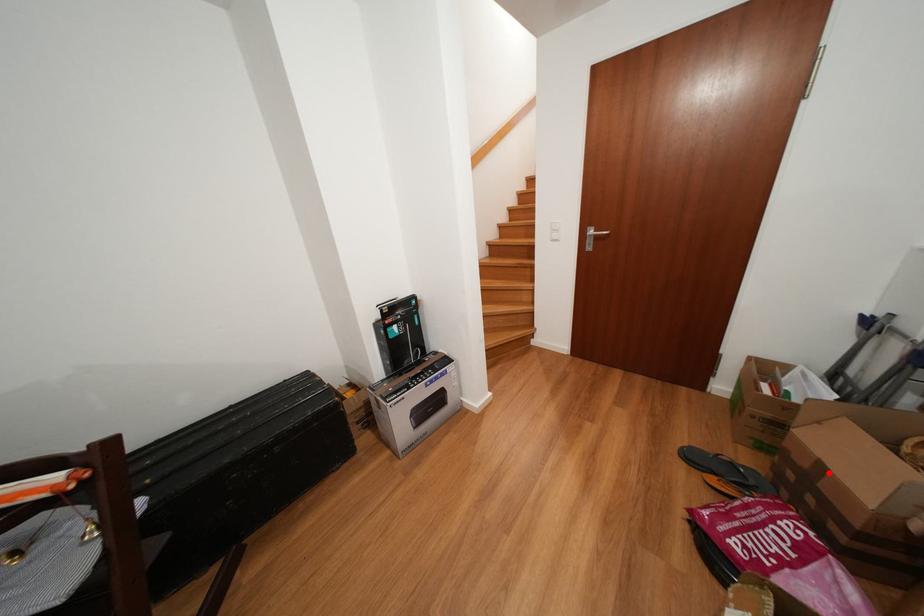
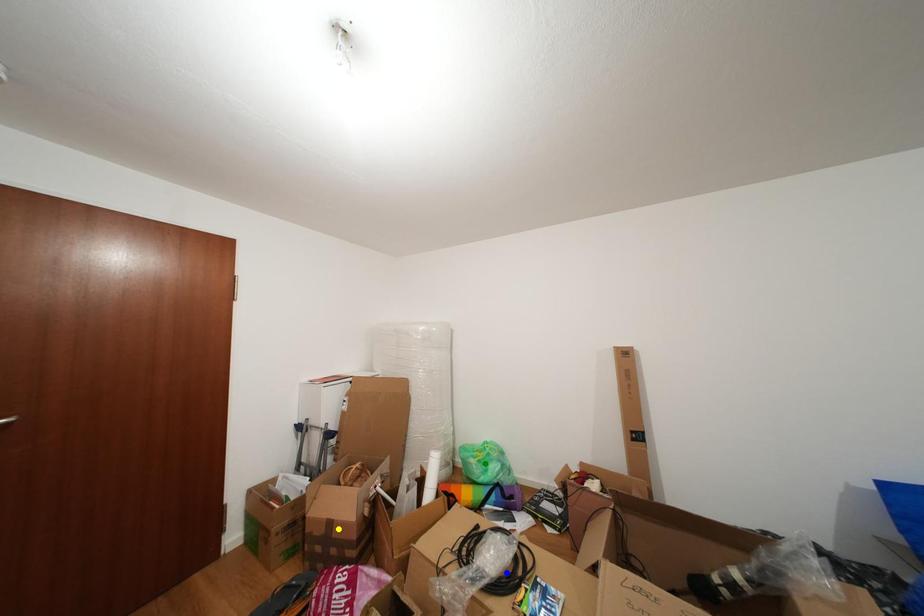
Question: I am providing you with two images of the same scene from different viewpoints. A red point is marked on the first image. You are given multiple points on the second image. Which spot in image 2 lines up with the point in image 1?

Choices:
 (A) yellow point
 (B) blue point
 (C) green point

Answer: (A)